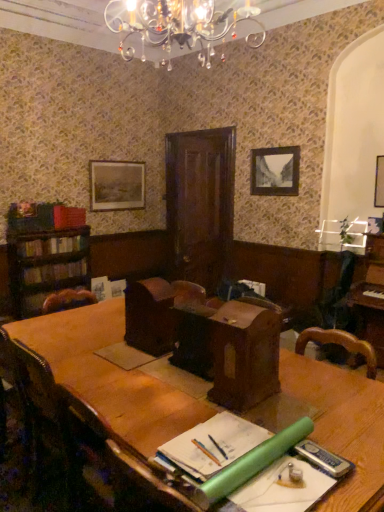
This screenshot has width=384, height=512. In order to click on vacant area in front of wooden desk at center in this screenshot , I will do `click(280, 419)`.